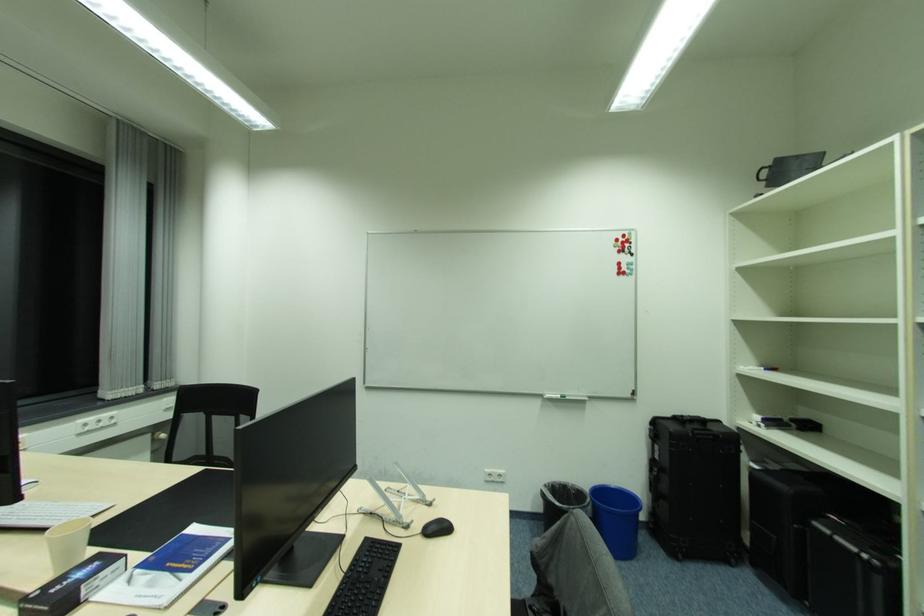
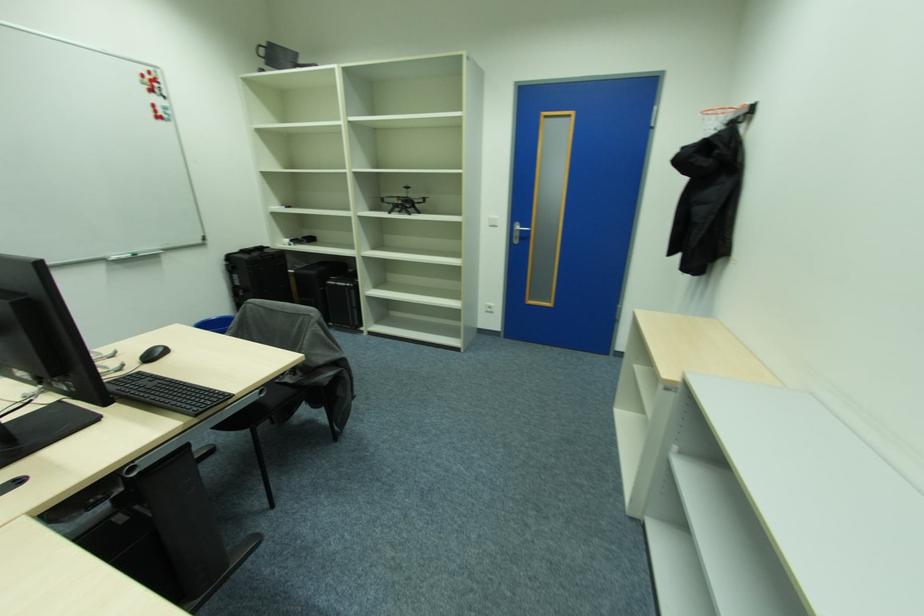
First-person continuous shooting, in which direction is the camera rotating?

The camera rotated toward right-down.